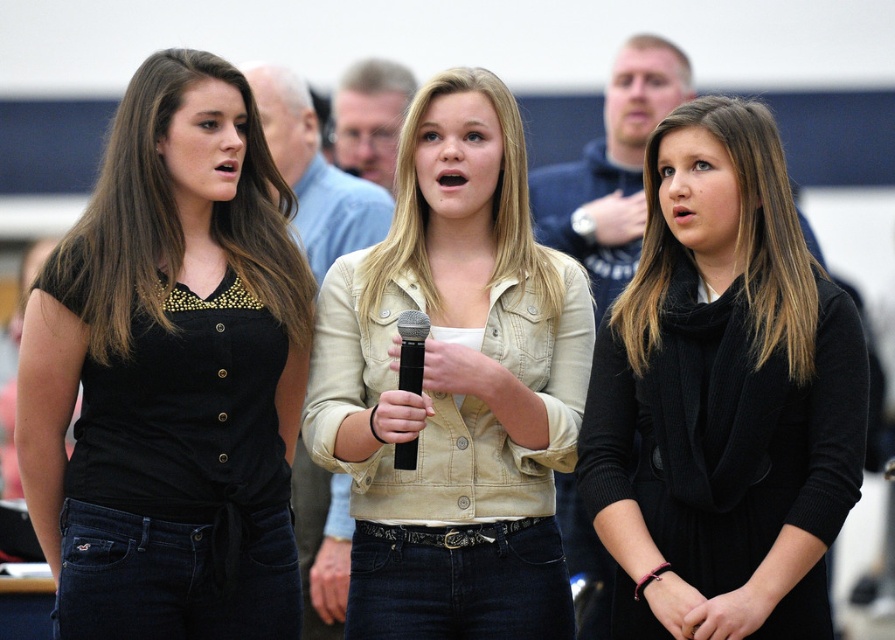
Question: Estimate the real-world distances between objects in this image. Which object is closer to the beige button-up jacket at center?

Choices:
 (A) black matte microphone at center
 (B) black matte shirt at left
 (C) black woolen scarf at center

Answer: (A)

Question: Which point is farther to the camera?

Choices:
 (A) black woolen scarf at center
 (B) black matte microphone at center
 (C) beige button-up jacket at center

Answer: (C)

Question: Can you confirm if black matte shirt at left is positioned to the right of black woolen scarf at center?

Choices:
 (A) yes
 (B) no

Answer: (B)

Question: Which point is farther from the camera taking this photo?

Choices:
 (A) (527, 246)
 (B) (582, 474)

Answer: (A)

Question: Does black woolen scarf at center have a smaller size compared to beige button-up jacket at center?

Choices:
 (A) no
 (B) yes

Answer: (B)

Question: Observing the image, what is the correct spatial positioning of black matte shirt at left in reference to beige button-up jacket at center?

Choices:
 (A) right
 (B) left

Answer: (B)